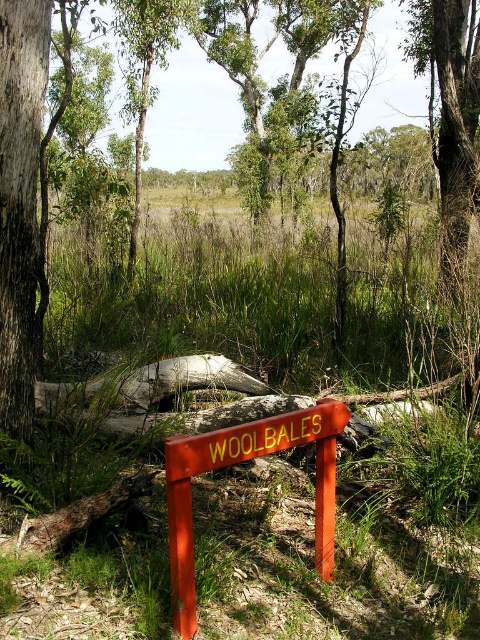
You are a hiker who needs to place a tent. You see the green grass at center and the orange painted wooden sign at center. Which area would be more suitable for setting up your tent?

The green grass at center is bigger than the orange painted wooden sign at center, so the green grass at center is more suitable for setting up the tent as it provides a larger and more stable surface area.